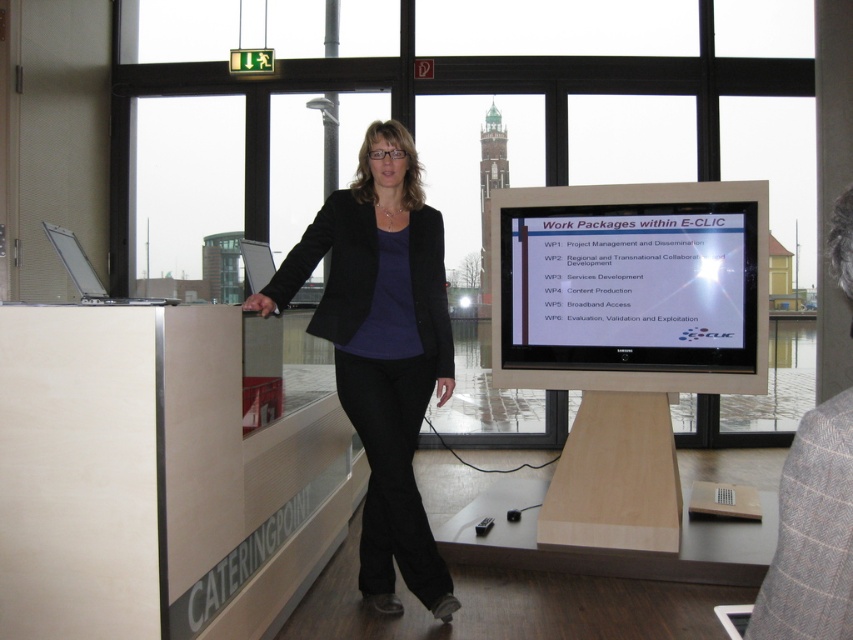
Question: Which object is farther from the camera taking this photo?

Choices:
 (A) matte black monitor at center
 (B) matte black blazer at center
 (C) light brown wooden table at lower center

Answer: (A)

Question: Which point appears closest to the camera in this image?

Choices:
 (A) [758, 525]
 (B) [103, 294]
 (C) [439, 554]
 (D) [741, 282]

Answer: (B)

Question: Which of these objects is positioned closest to the light brown wooden table at lower center?

Choices:
 (A) matte black blazer at center
 (B) matte black monitor at center

Answer: (B)

Question: Can you confirm if light brown wooden table at lower center is positioned to the right of silver metallic laptop at left?

Choices:
 (A) no
 (B) yes

Answer: (B)

Question: In this image, where is matte black blazer at center located relative to light brown wooden table at lower center?

Choices:
 (A) below
 (B) above

Answer: (B)

Question: From the image, what is the correct spatial relationship of matte black monitor at center in relation to silver metallic laptop at left?

Choices:
 (A) right
 (B) left

Answer: (A)